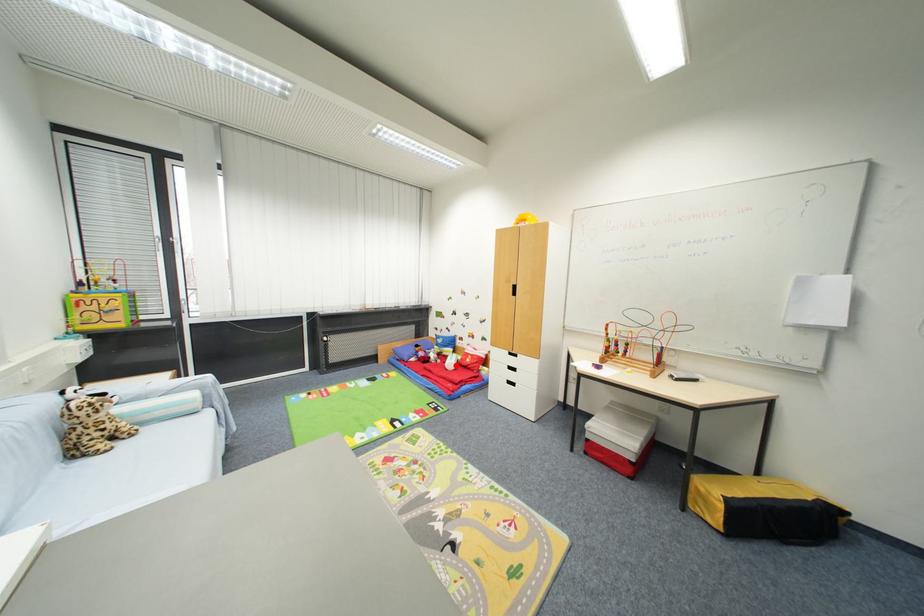
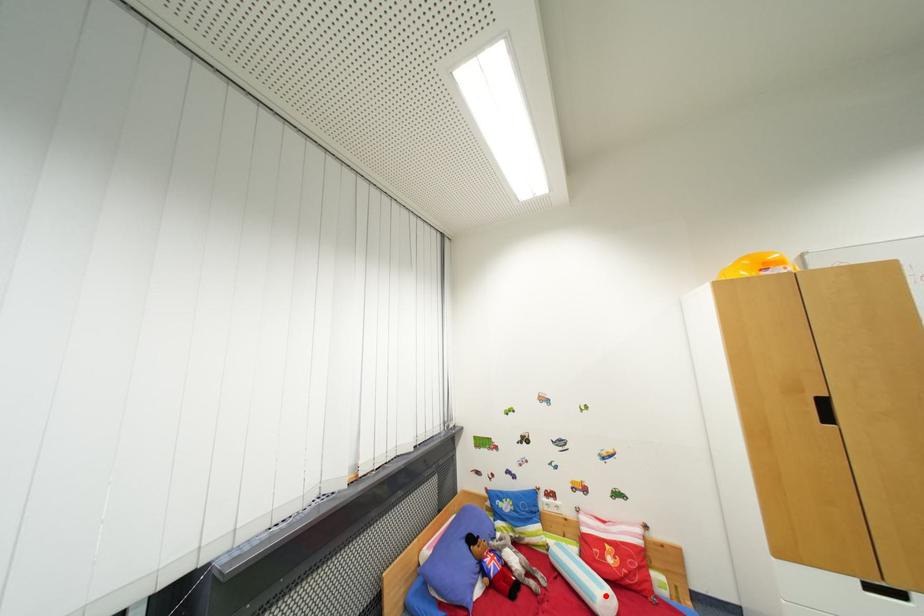
In the scene shown: I am providing you with two images of the same scene from different viewpoints. A red point is marked on the first image and another point is marked on the second image. Is the red point in image1 aligned with the point shown in image2?

Yes